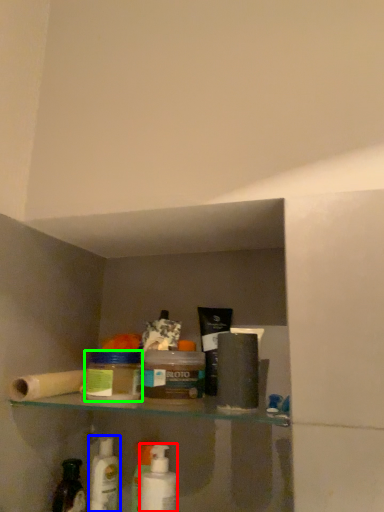
Question: Estimate the real-world distances between objects in this image. Which object is farther from mouthwash (highlighted by a red box), mouthwash (highlighted by a blue box) or product (highlighted by a green box)?

Choices:
 (A) mouthwash
 (B) product

Answer: (B)